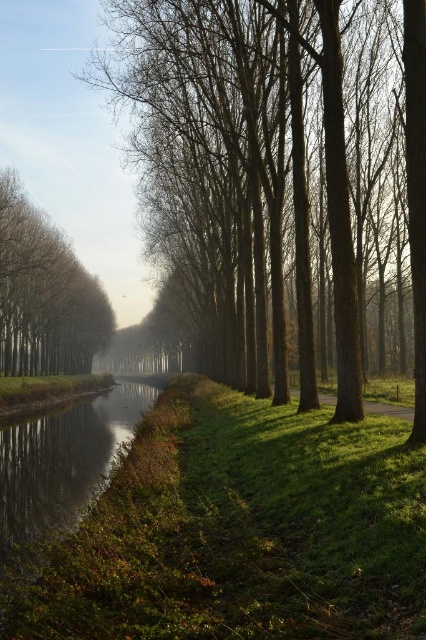
Question: Which object is closer to the camera taking this photo?

Choices:
 (A) green grassy path at center
 (B) brown smooth tree at left
 (C) smooth bark trees at center

Answer: (C)

Question: Which object is the closest to the smooth bark trees at center?

Choices:
 (A) green grassy path at center
 (B) brown smooth tree at left

Answer: (A)

Question: Can you confirm if brown smooth tree at left is positioned above green grassy path at center?

Choices:
 (A) yes
 (B) no

Answer: (A)

Question: Can you confirm if brown smooth tree at left is positioned above green grassy path at center?

Choices:
 (A) no
 (B) yes

Answer: (B)

Question: Which point is closer to the camera taking this photo?

Choices:
 (A) (52, 369)
 (B) (281, 321)

Answer: (B)

Question: Can you confirm if smooth bark trees at center is smaller than green grassy path at center?

Choices:
 (A) yes
 (B) no

Answer: (B)